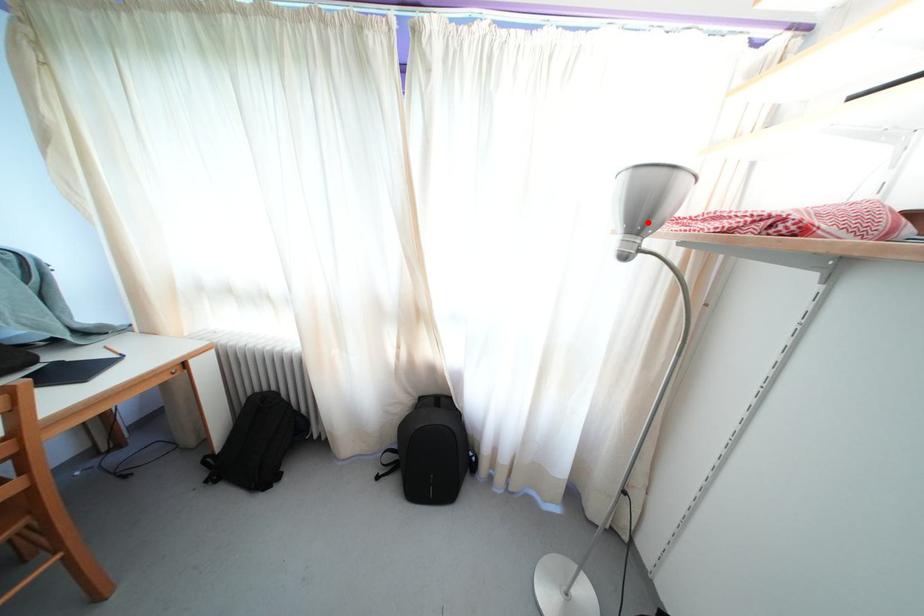
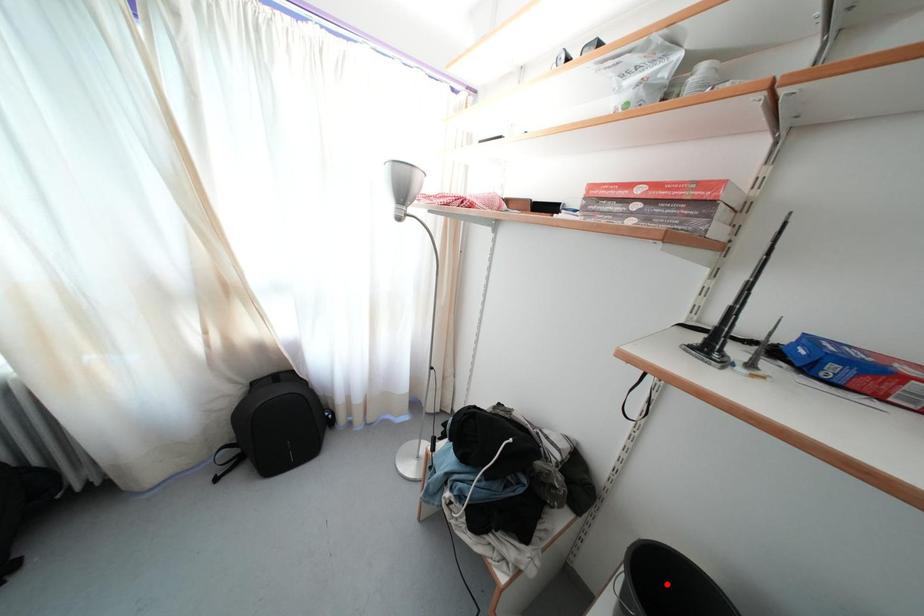
I am providing you with two images of the same scene from different viewpoints. A red point is marked on the first image and another point is marked on the second image. Does the point marked in image1 correspond to the same location as the one in image2?

No